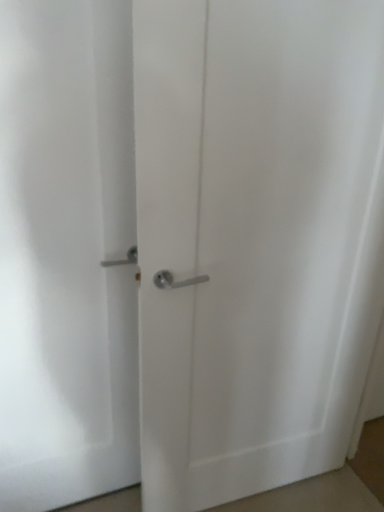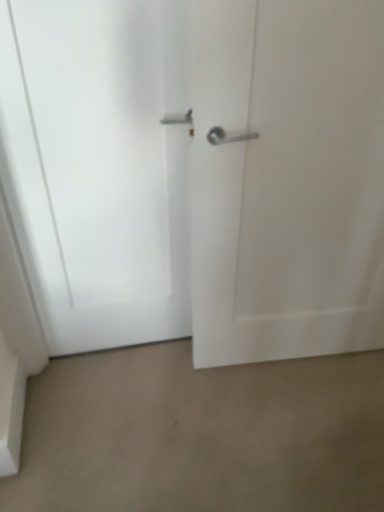
Question: Which way did the camera rotate in the video?

Choices:
 (A) rotated left
 (B) rotated right

Answer: (A)